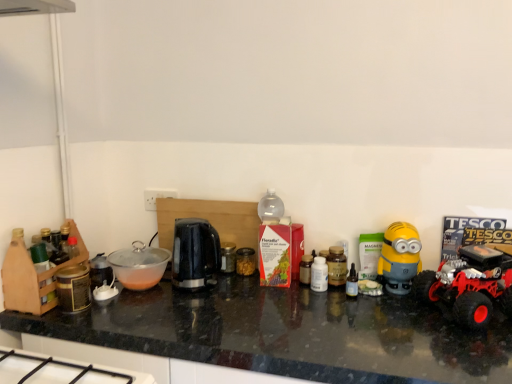
What are the coordinates of `free location in front of yellow matte minion toy at right, the second toy positioned from the left` in the screenshot? It's located at (402, 316).